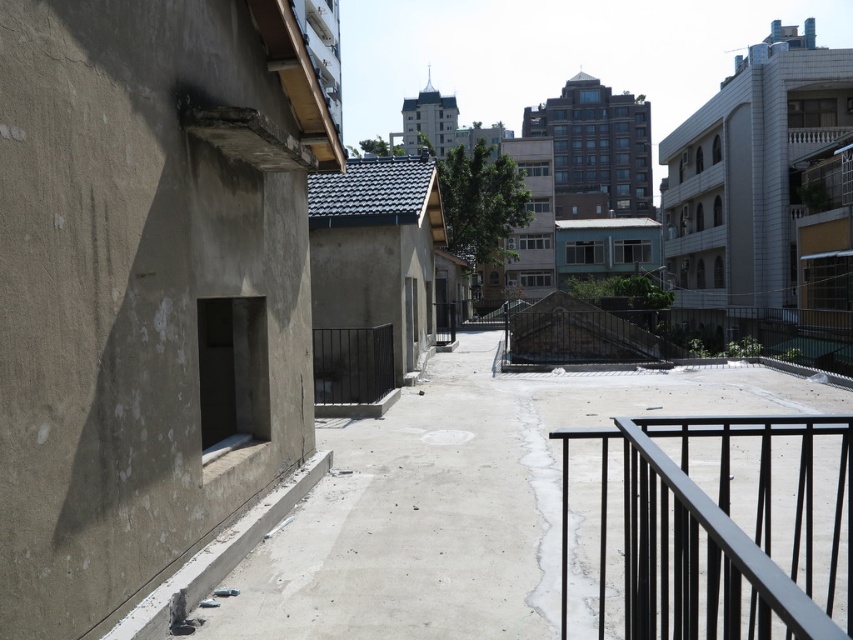
Question: Is smooth concrete alley at center to the right of black metal railing at right from the viewer's perspective?

Choices:
 (A) no
 (B) yes

Answer: (B)

Question: Can you confirm if smooth concrete alley at center is thinner than black metal railing at right?

Choices:
 (A) yes
 (B) no

Answer: (B)

Question: Which of the following is the farthest from the observer?

Choices:
 (A) black metal railing at right
 (B) smooth concrete alley at center

Answer: (A)

Question: Which point appears farthest from the camera in this image?

Choices:
 (A) (746, 472)
 (B) (840, 554)

Answer: (A)

Question: Is smooth concrete alley at center thinner than black metal railing at right?

Choices:
 (A) no
 (B) yes

Answer: (A)